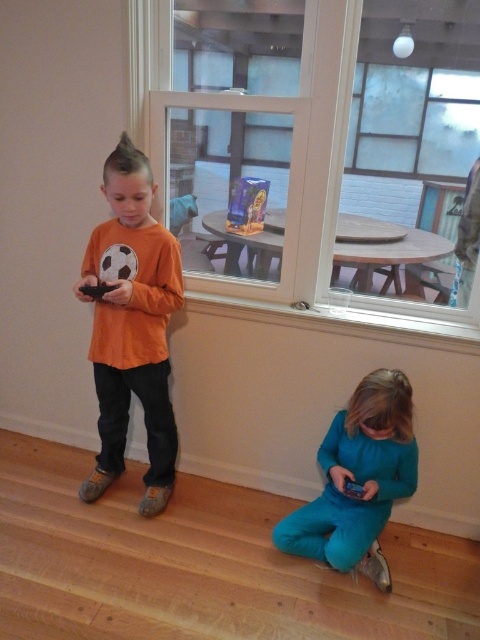
Does point (338, 164) come farther from viewer compared to point (357, 413)?

Yes, it is behind point (357, 413).

Who is more distant from viewer, (303, 84) or (336, 492)?

Result: The point (336, 492) is more distant.

Who is more forward, [354,12] or [381,572]?

Positioned in front is point [354,12].

In order to click on clear glass window at upper center in this screenshot , I will do `click(313, 189)`.

In the scene shown: Is orange matte shirt at center taller than clear glass window at upper center?

Indeed, orange matte shirt at center has a greater height compared to clear glass window at upper center.

Measure the distance between orange matte shirt at center and camera.

orange matte shirt at center and camera are 1.87 meters apart.

Where is `orange matte shirt at center`? orange matte shirt at center is located at coordinates (132, 324).

Consider the image. Which is above, orange matte shirt at center or teal fabric pants at lower center?

orange matte shirt at center is above.

Which of these two, orange matte shirt at center or teal fabric pants at lower center, stands shorter?

Standing shorter between the two is teal fabric pants at lower center.

The width and height of the screenshot is (480, 640). What are the coordinates of `orange matte shirt at center` in the screenshot? It's located at (132, 324).